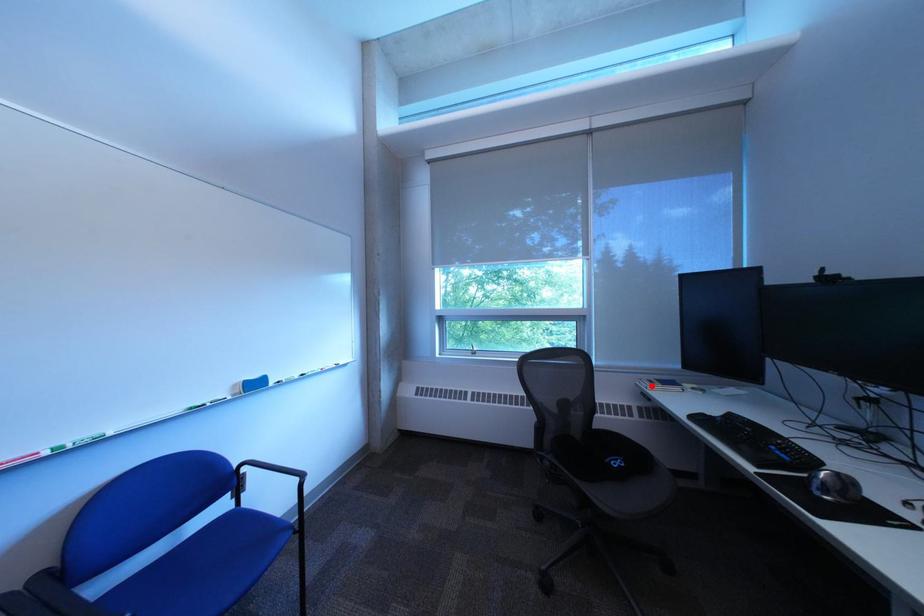
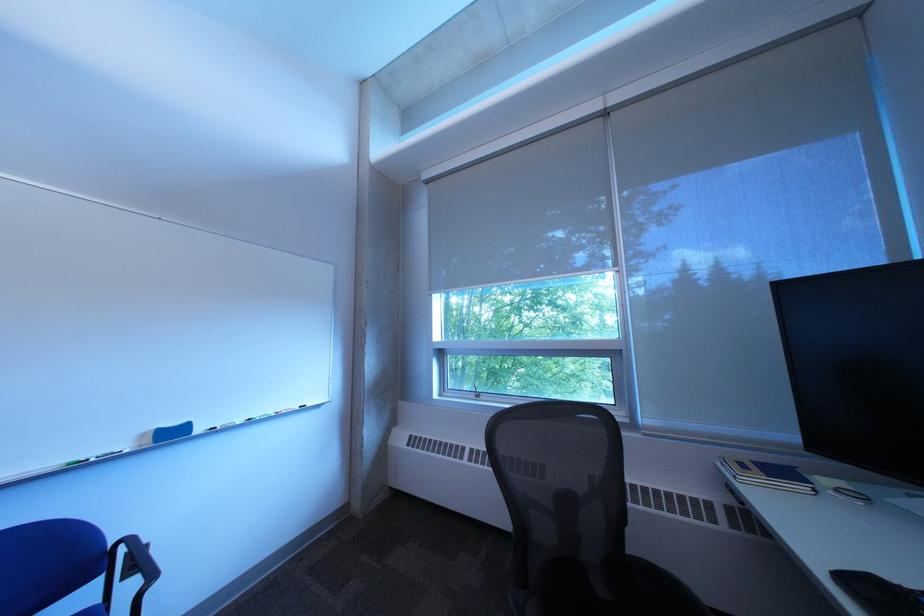
Question: I am providing you with two images of the same scene from different viewpoints. A red point is marked on the first image. Can you still see the location of the red point in image 2?

Choices:
 (A) Yes
 (B) No

Answer: (A)